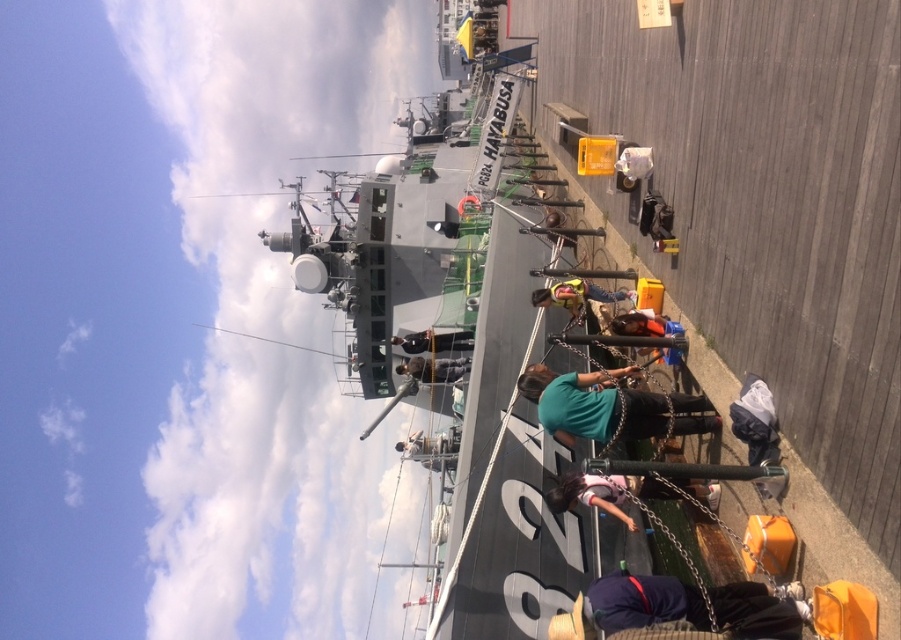
Who is more forward, (684, 432) or (703, 499)?

Point (684, 432)

Who is positioned more to the right, teal fabric shirt at center or pink fabric shirt at lower center?

From the viewer's perspective, pink fabric shirt at lower center appears more on the right side.

What do you see at coordinates (608, 406) in the screenshot? Image resolution: width=901 pixels, height=640 pixels. I see `teal fabric shirt at center` at bounding box center [608, 406].

Locate an element on the screen. teal fabric shirt at center is located at coordinates (608, 406).

Which of these two, dark blue fabric at lower right or dark gray uniform at center, stands taller?

With more height is dark blue fabric at lower right.

Who is more forward, (648, 593) or (417, 362)?

Positioned in front is point (648, 593).

Does point (681, 618) lie in front of point (412, 371)?

Yes, it is in front of point (412, 371).

Image resolution: width=901 pixels, height=640 pixels. Identify the location of dark blue fabric at lower right. (642, 602).

Does teal fabric shirt at center have a greater height compared to dark gray uniform at center?

Yes.

From the picture: Is teal fabric shirt at center positioned at the back of dark gray uniform at center?

No, it is not.

Does point (558, 419) come behind point (428, 371)?

No, it is in front of (428, 371).

Find the location of a particular element. The image size is (901, 640). teal fabric shirt at center is located at coordinates (608, 406).